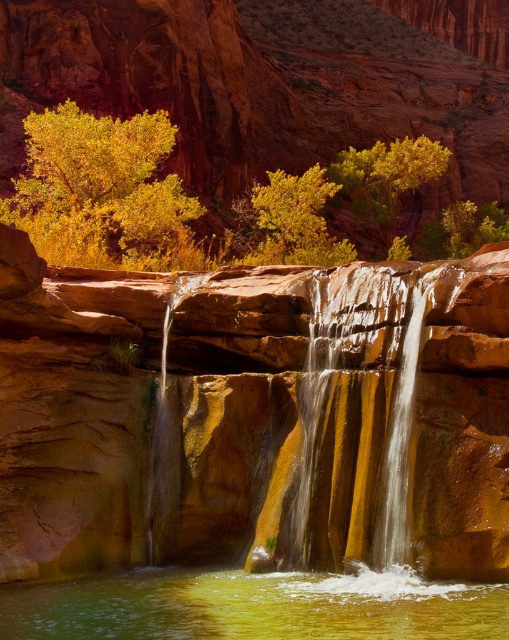
You are standing at the edge of the canyon looking at the waterfall. There are two points marked in the image. Which point is closer to you, point (337, 563) or point (101, 160)?

Point (337, 563) is closer to the viewer than point (101, 160).

What is the color and texture of the object located at the coordinates point (360, 403) in the image?

The object at point (360, 403) is a smooth golden rock at center.

You are a hiker who wants to cross the canyon. You see the green translucent water at lower center and the smooth golden rock at center. Which one would you choose to step on to avoid getting wet?

The smooth golden rock at center is larger in size compared to the green translucent water at lower center, so stepping on the smooth golden rock at center would be safer to avoid getting wet.